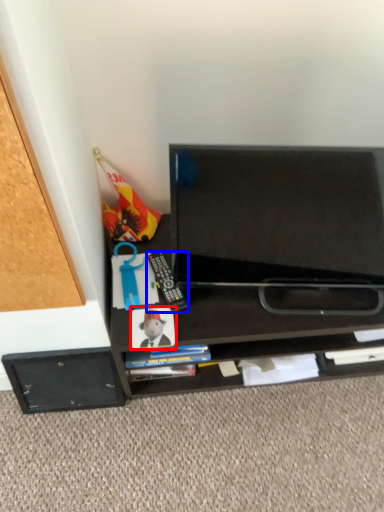
Question: Which object appears closest to the camera in this image, paperback book (highlighted by a red box) or equipment (highlighted by a blue box)?

Choices:
 (A) paperback book
 (B) equipment

Answer: (A)